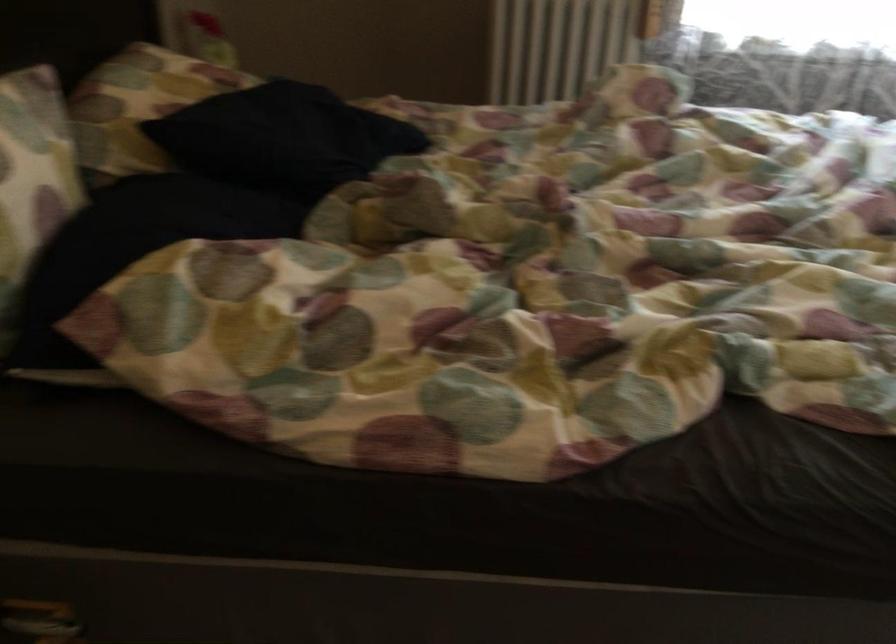
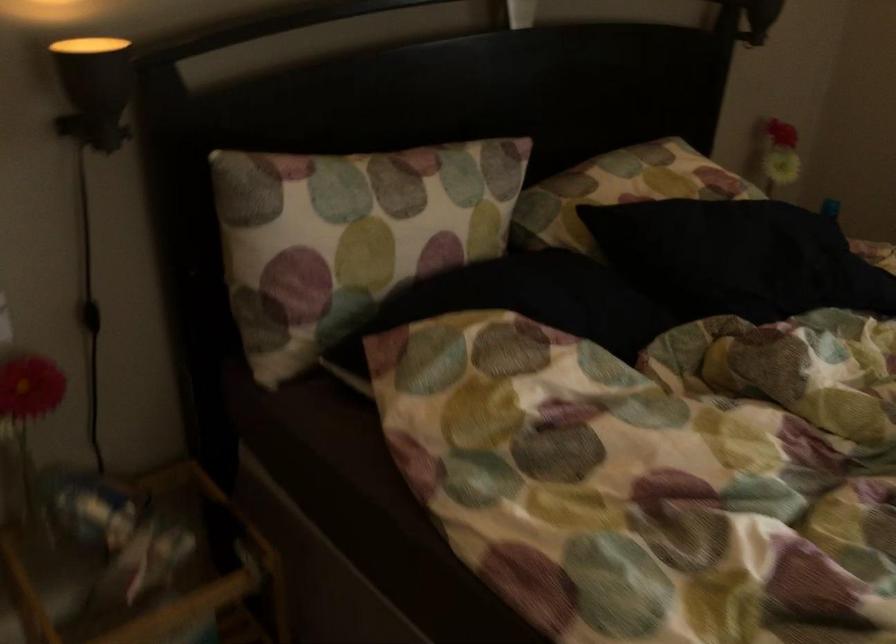
Question: The camera is either moving clockwise (left) or counter-clockwise (right) around the object. The first image is from the beginning of the video and the second image is from the end. Is the camera moving left or right when shooting the video?

Choices:
 (A) Left
 (B) Right

Answer: (B)